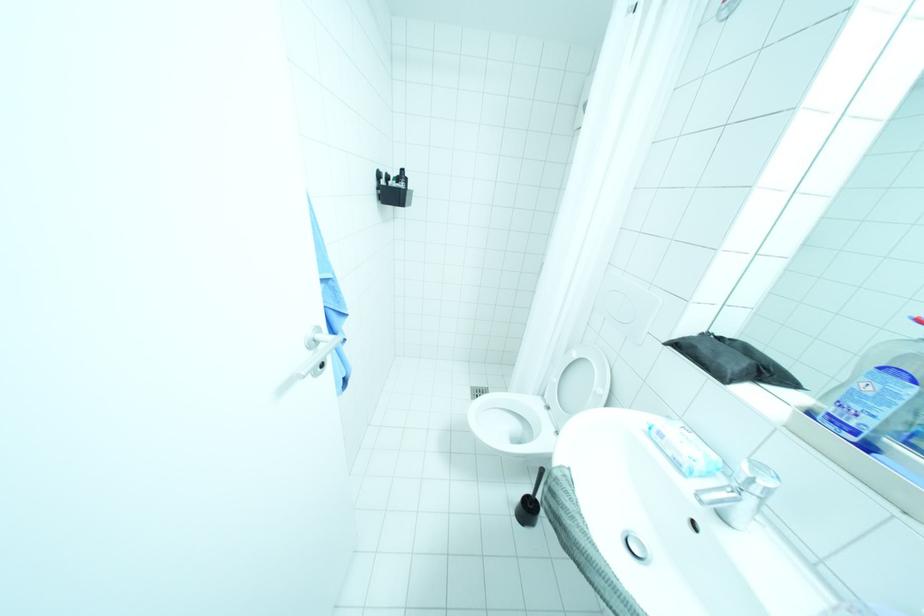
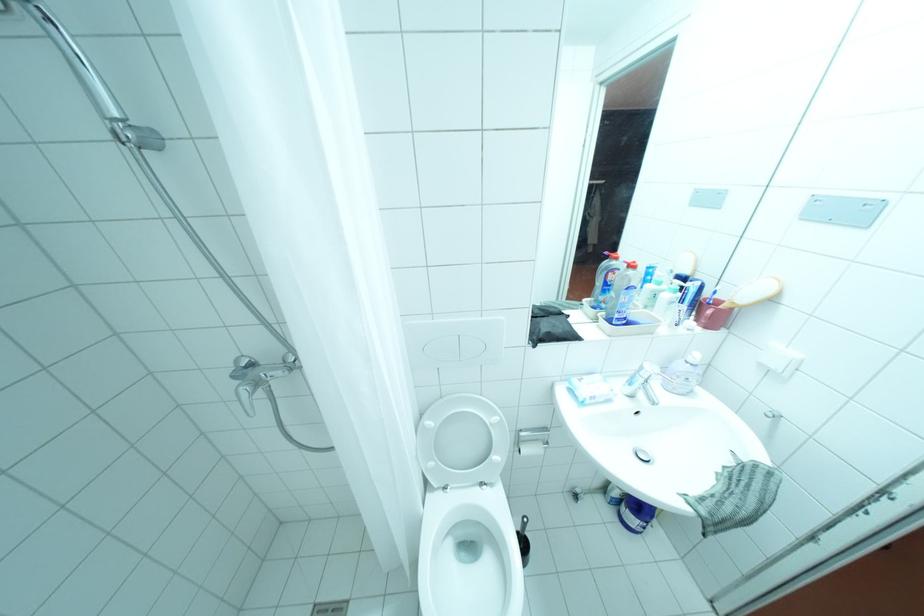
The point at (556, 407) is marked in the first image. Where is the corresponding point in the second image?

(455, 487)